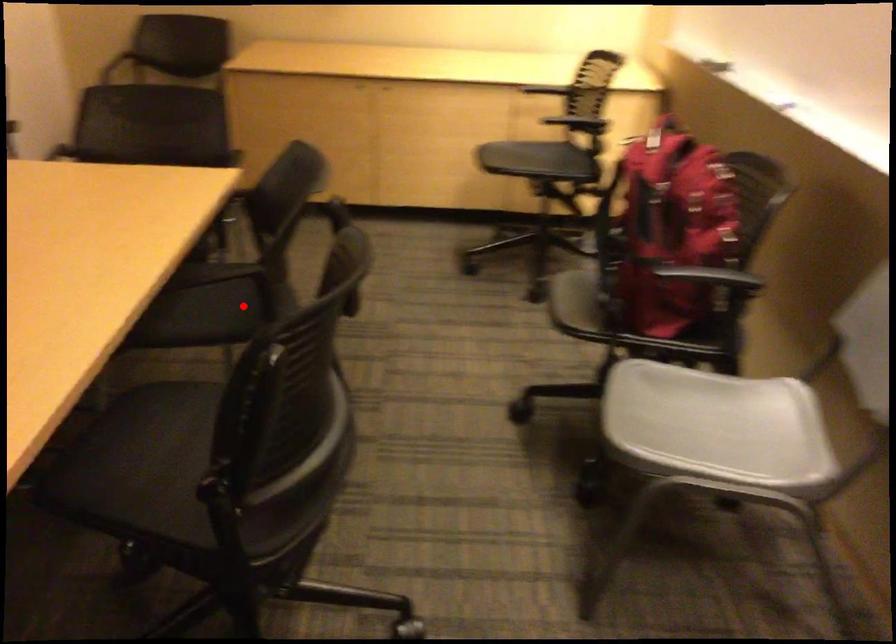
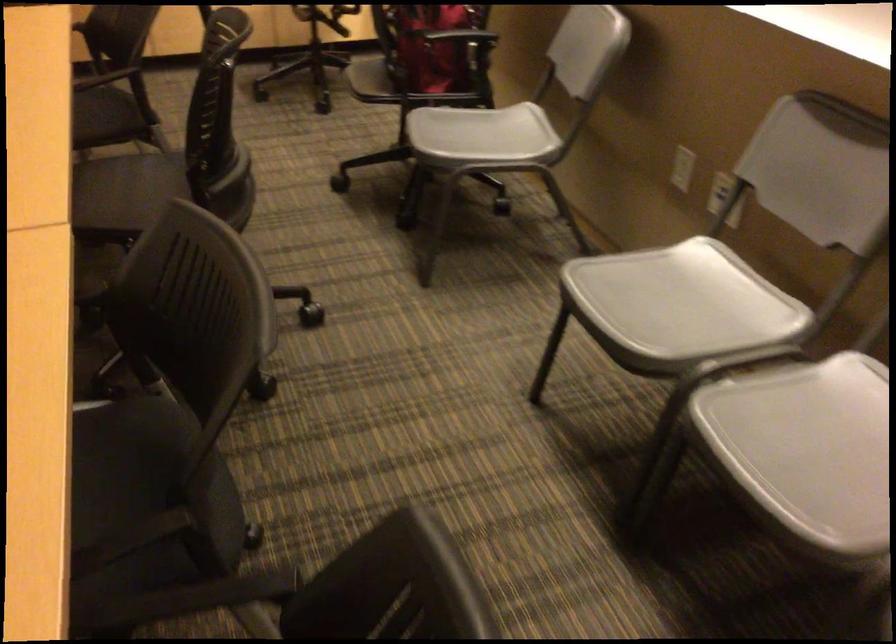
Question: I am providing you with two images of the same scene from different viewpoints. A red point is shown in image1. For the corresponding object point in image2, is it positioned nearer or farther from the camera?

Choices:
 (A) Nearer
 (B) Farther

Answer: (B)